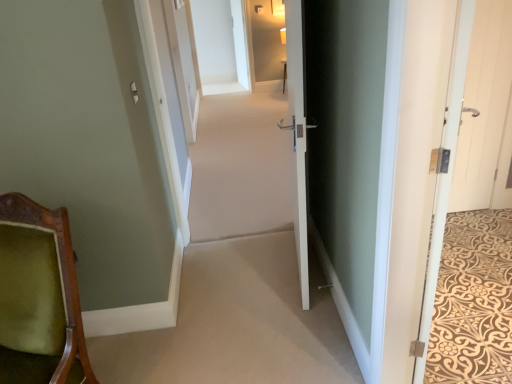
Question: Is white wood door at right, the 4th door from the left, positioned far away from white wooden door at right, the 3th door positioned from the left?

Choices:
 (A) yes
 (B) no

Answer: (A)

Question: Is white wooden door at right, the second door from the right, a part of white wood door at right, which is counted as the first door, starting from the right?

Choices:
 (A) yes
 (B) no

Answer: (B)

Question: Is white wood door at right, which is counted as the first door, starting from the right, positioned with its back to white wooden door at right, the second door from the right?

Choices:
 (A) no
 (B) yes

Answer: (A)

Question: Can you confirm if white wood door at right, the 4th door from the left, is taller than white wooden door at right, the 3th door positioned from the left?

Choices:
 (A) yes
 (B) no

Answer: (B)

Question: Considering the relative positions of white wood door at right, the 4th door from the left, and white wooden door at right, the 3th door positioned from the left, in the image provided, is white wood door at right, the 4th door from the left, to the right of white wooden door at right, the 3th door positioned from the left, from the viewer's perspective?

Choices:
 (A) no
 (B) yes

Answer: (B)

Question: From a real-world perspective, is white wood door at right, the 4th door from the left, over white wooden door at right, the 3th door positioned from the left?

Choices:
 (A) no
 (B) yes

Answer: (A)

Question: From the image's perspective, is white glossy door at center, which ranks as the 4th door in right-to-left order, over beige carpet at center?

Choices:
 (A) yes
 (B) no

Answer: (B)

Question: Is white glossy door at center, which appears as the 1th door when viewed from the left, bigger than beige carpet at center?

Choices:
 (A) yes
 (B) no

Answer: (A)

Question: Is white glossy door at center, which ranks as the 4th door in right-to-left order, in front of beige carpet at center?

Choices:
 (A) no
 (B) yes

Answer: (B)

Question: Would you say beige carpet at center is part of white glossy door at center, which appears as the 1th door when viewed from the left,'s contents?

Choices:
 (A) yes
 (B) no

Answer: (B)

Question: Are white glossy door at center, which appears as the 1th door when viewed from the left, and beige carpet at center making contact?

Choices:
 (A) no
 (B) yes

Answer: (A)

Question: Is white glossy door at center, which ranks as the 4th door in right-to-left order, aimed at beige carpet at center?

Choices:
 (A) no
 (B) yes

Answer: (B)

Question: Is white wood door at right, the third door positioned from the right, closer to camera compared to white wooden door at right, the second door from the right?

Choices:
 (A) no
 (B) yes

Answer: (B)